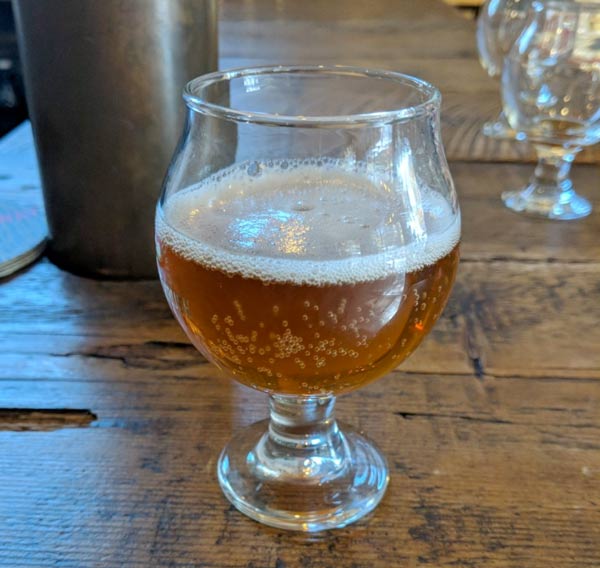
Where is `rim of cup`? rim of cup is located at coordinates point(338,116).